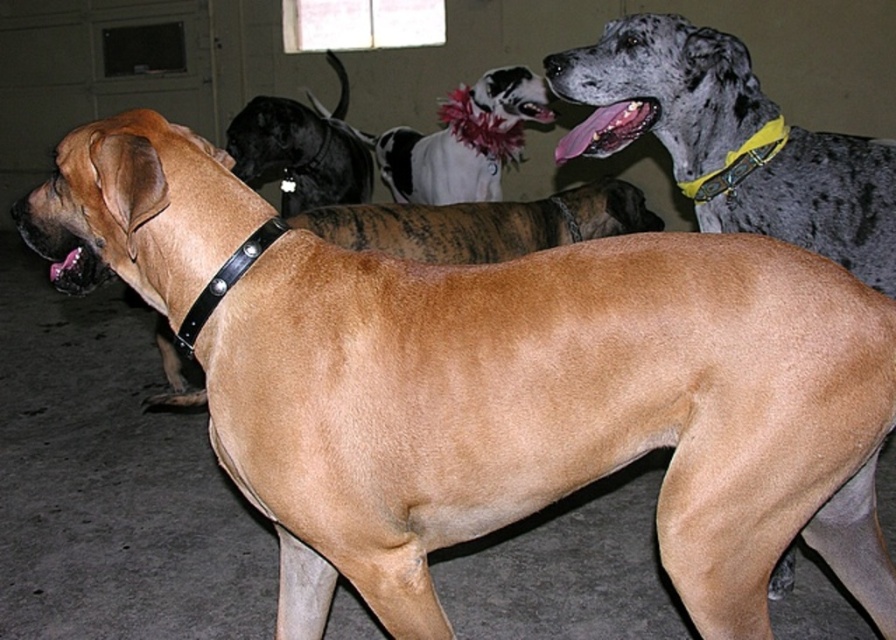
Does white-spotted fur at center have a greater width compared to pink leather collar at lower left?

A: Indeed, white-spotted fur at center has a greater width compared to pink leather collar at lower left.

Between white-spotted fur at center and pink leather collar at lower left, which one is positioned lower?

pink leather collar at lower left is lower down.

Who is more forward, (x=461, y=144) or (x=52, y=268)?

Point (x=52, y=268) is in front.

Locate an element on the screen. This screenshot has width=896, height=640. white-spotted fur at center is located at coordinates (435, 166).

Between black leather collar at upper left and white-spotted fur at center, which one has more height?

black leather collar at upper left is taller.

Between black leather collar at upper left and white-spotted fur at center, which one is positioned lower?

white-spotted fur at center is below.

Locate an element on the screen. This screenshot has height=640, width=896. black leather collar at upper left is located at coordinates (300, 150).

Is black leather collar at upper left to the right of pink leather collar at lower left from the viewer's perspective?

Yes, black leather collar at upper left is to the right of pink leather collar at lower left.

Can you confirm if black leather collar at upper left is taller than pink leather collar at lower left?

Yes, black leather collar at upper left is taller than pink leather collar at lower left.

This screenshot has width=896, height=640. What do you see at coordinates (300, 150) in the screenshot? I see `black leather collar at upper left` at bounding box center [300, 150].

Locate an element on the screen. This screenshot has width=896, height=640. black leather collar at upper left is located at coordinates (300, 150).